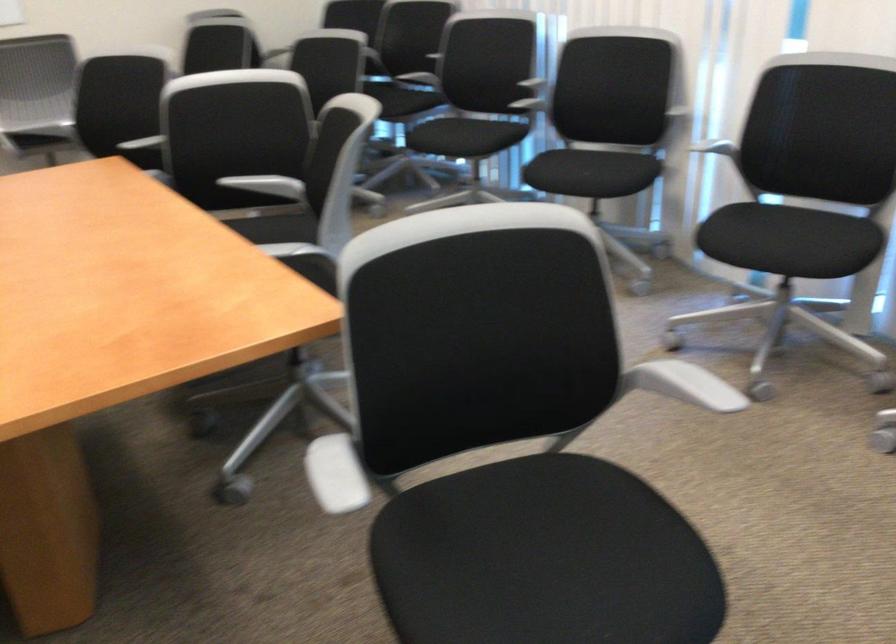
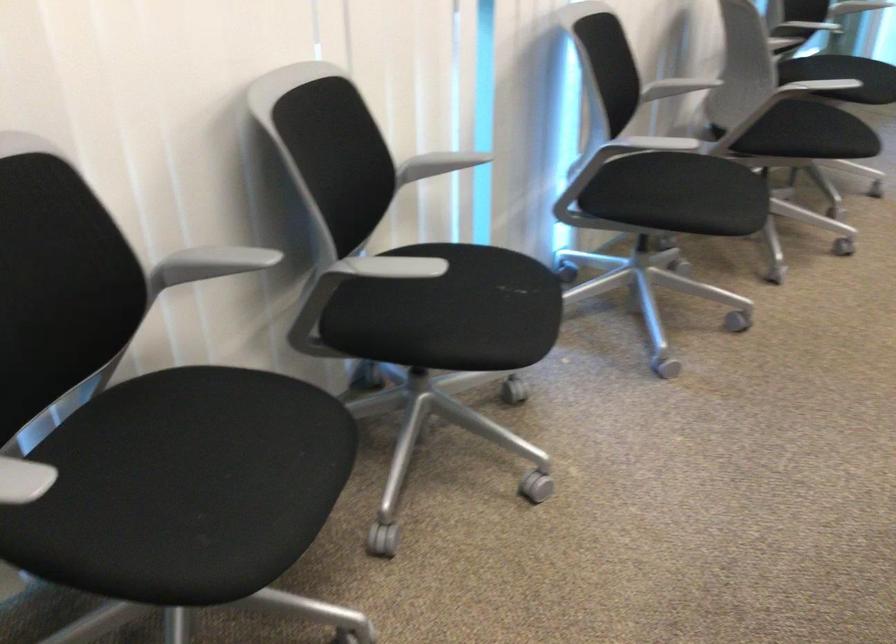
Question: I am providing you with two images of the same scene from different viewpoints. Which of the following objects are not visible in image2?

Choices:
 (A) white chair armrest
 (B) orange handled pliers
 (C) black chair sitting surface
 (D) grey chair armrest

Answer: (A)